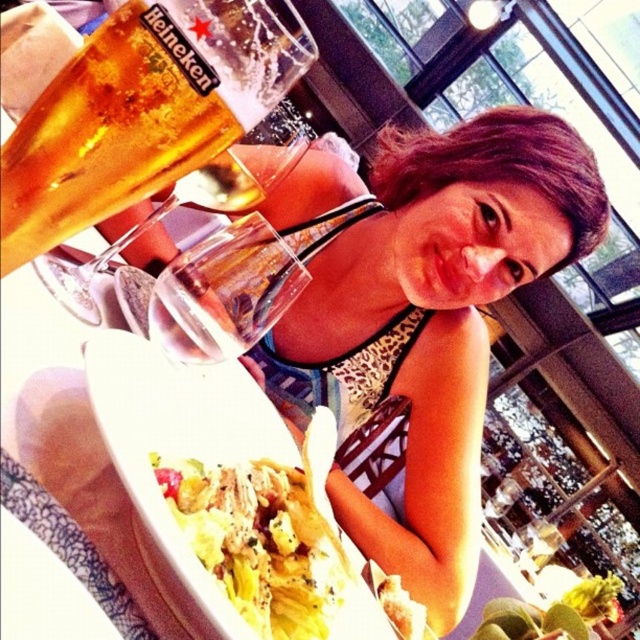
You are standing in front of the dining table and want to place a new item exactly where the leopard print bikini top at center is currently located. What are the coordinates you should aim for?

The coordinates for the leopard print bikini top at center are at point (339,372), so you should aim for those coordinates.

Based on the photo, you are a waiter at a restaurant and you see the golden amber liquid at upper left and the clear glass wine glass at upper left on a table. Which one is closer to the customer?

The golden amber liquid at upper left is closer to the customer because it is in front of the clear glass wine glass at upper left.

You are a waiter at a beachside restaurant. A customer asks if the yellow crisp lettuce at lower center is visible from their seat across the table. Considering the leopard print bikini top at center is blocking part of the view, can they see it?

The yellow crisp lettuce at lower center is positioned under the leopard print bikini top at center, so it might be partially or fully obscured from the customer across the table.